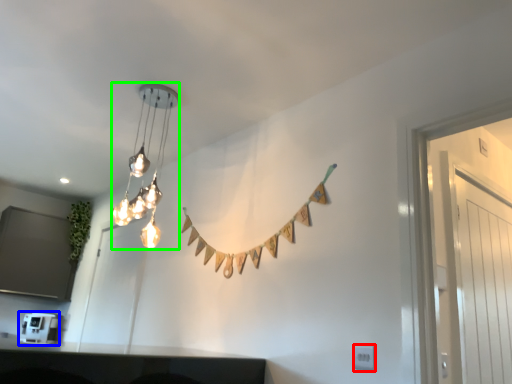
Question: Which object is positioned closest to electric outlet (highlighted by a red box)? Select from appliance (highlighted by a blue box) and lamp (highlighted by a green box).

Choices:
 (A) appliance
 (B) lamp

Answer: (B)